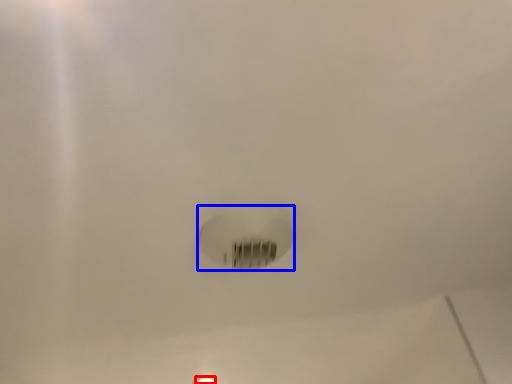
Question: Which of the following is the farthest to the observer, light fixture (highlighted by a red box) or light bulb (highlighted by a blue box)?

Choices:
 (A) light fixture
 (B) light bulb

Answer: (A)